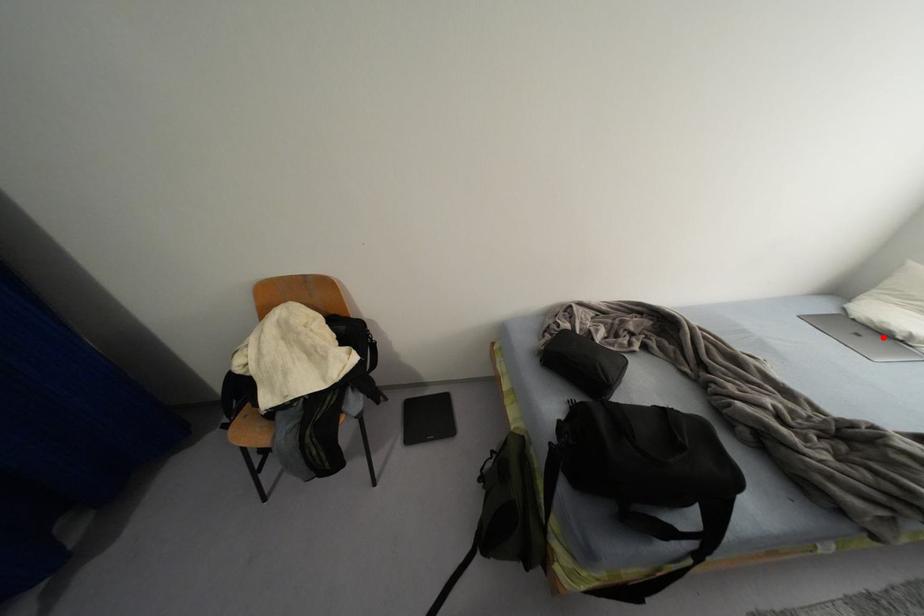
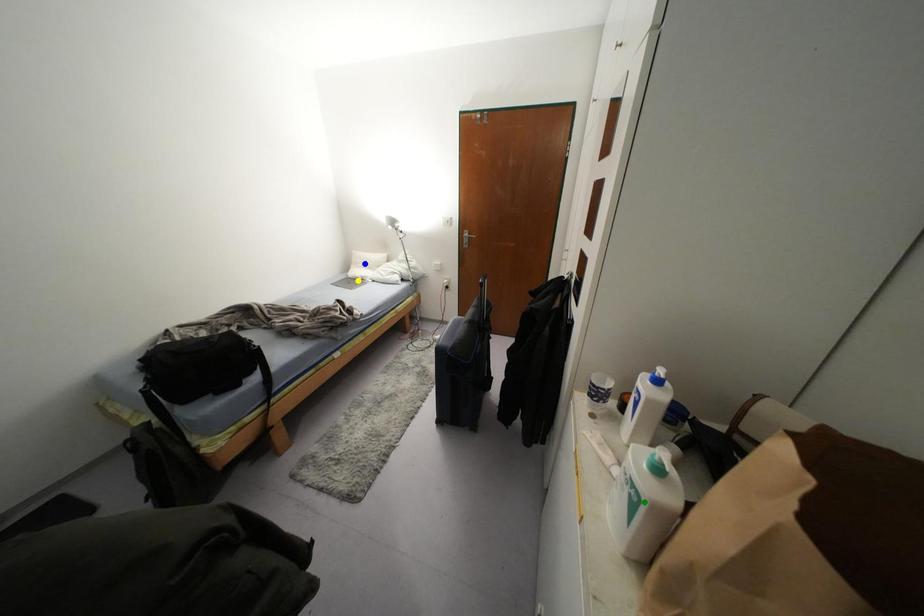
Question: I am providing you with two images of the same scene from different viewpoints. A red point is marked on the first image. You are given multiple points on the second image. In image 2, which mark is for the same physical point as the one in image 1?

Choices:
 (A) blue point
 (B) green point
 (C) yellow point

Answer: (C)